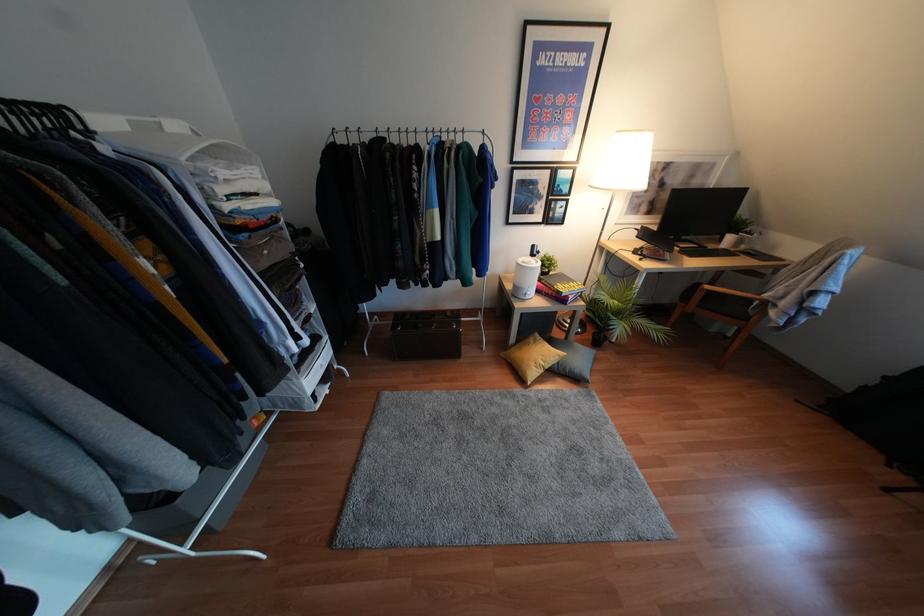
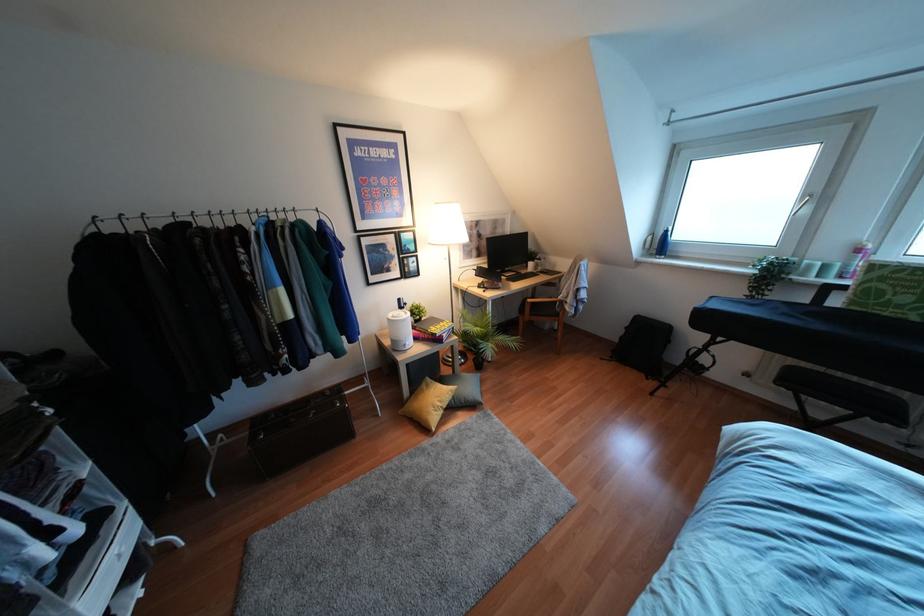
The point at [526,297] is marked in the first image. Where is the corresponding point in the second image?

(407, 347)